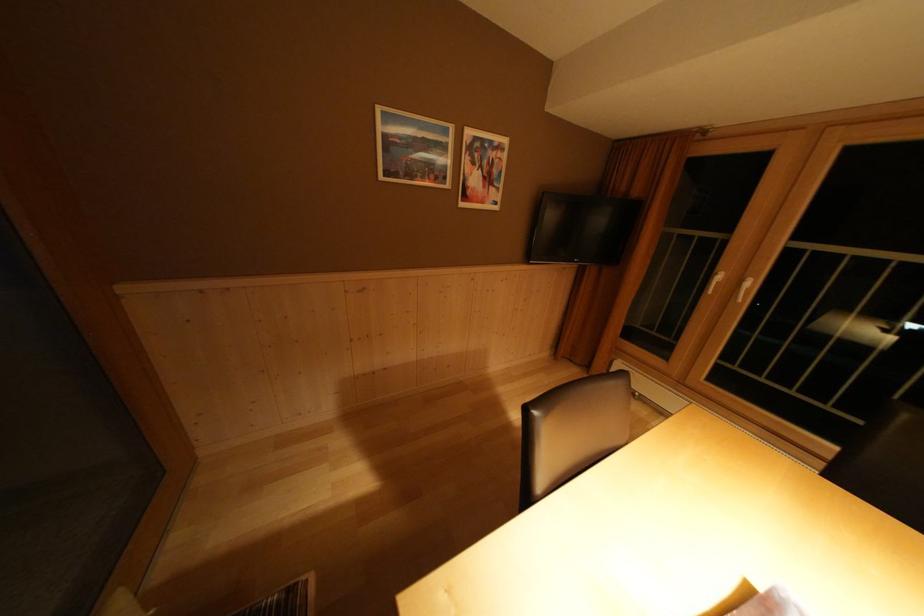
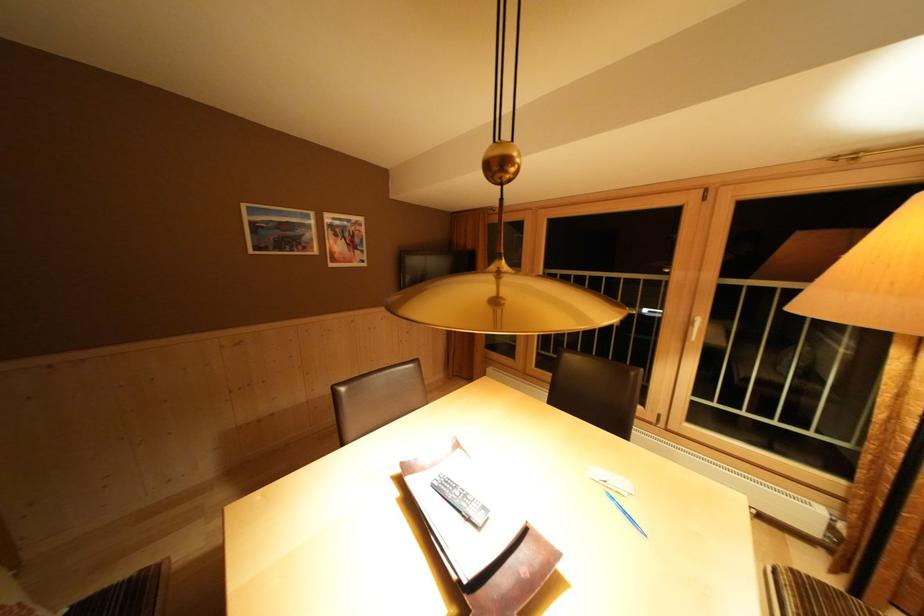
Question: The images are taken continuously from a first-person perspective. In which direction is your viewpoint rotating?

Choices:
 (A) Left
 (B) Right
 (C) Up
 (D) Down

Answer: (B)